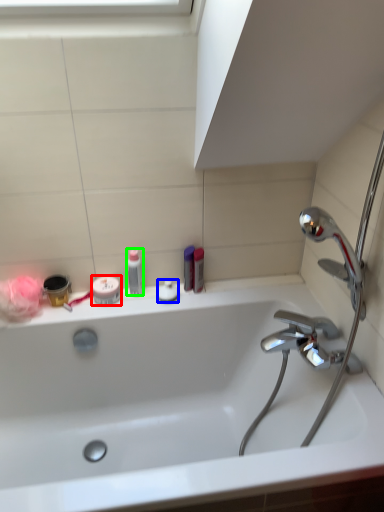
Question: Which is farther away from mouthwash (highlighted by a red box)? toiletry (highlighted by a blue box) or toiletry (highlighted by a green box)?

Choices:
 (A) toiletry
 (B) toiletry

Answer: (A)